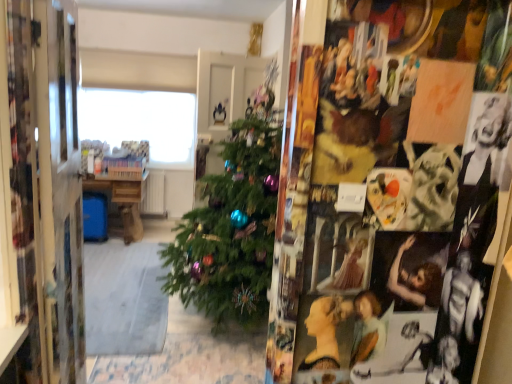
Question: Is metallic silver mirror at left facing away from wooden table at center?

Choices:
 (A) no
 (B) yes

Answer: (A)

Question: Is metallic silver mirror at left surrounding wooden table at center?

Choices:
 (A) yes
 (B) no

Answer: (B)

Question: Is metallic silver mirror at left in contact with wooden table at center?

Choices:
 (A) yes
 (B) no

Answer: (B)

Question: Is metallic silver mirror at left to the left of wooden table at center from the viewer's perspective?

Choices:
 (A) no
 (B) yes

Answer: (A)

Question: From a real-world perspective, is metallic silver mirror at left located beneath wooden table at center?

Choices:
 (A) no
 (B) yes

Answer: (A)

Question: From a real-world perspective, is metallic silver mirror at left on top of wooden table at center?

Choices:
 (A) no
 (B) yes

Answer: (B)

Question: Is wooden table at center shorter than metallic silver mirror at left?

Choices:
 (A) yes
 (B) no

Answer: (A)

Question: From the image's perspective, does wooden table at center appear lower than metallic silver mirror at left?

Choices:
 (A) no
 (B) yes

Answer: (B)

Question: Could you tell me if wooden table at center is turned towards metallic silver mirror at left?

Choices:
 (A) no
 (B) yes

Answer: (B)

Question: Is wooden table at center directly adjacent to metallic silver mirror at left?

Choices:
 (A) no
 (B) yes

Answer: (A)

Question: Is wooden table at center oriented away from metallic silver mirror at left?

Choices:
 (A) no
 (B) yes

Answer: (A)

Question: From the image's perspective, is wooden table at center over metallic silver mirror at left?

Choices:
 (A) yes
 (B) no

Answer: (B)

Question: Does transparent glass window at upper center have a lesser width compared to metallic silver mirror at left?

Choices:
 (A) no
 (B) yes

Answer: (B)